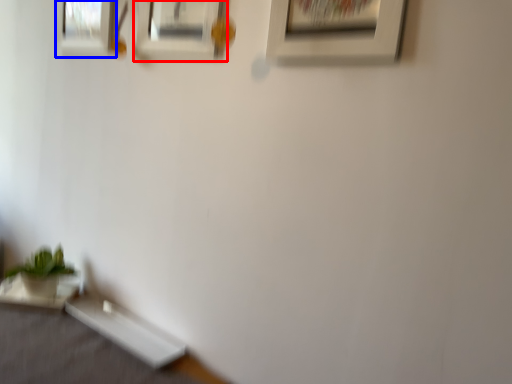
Question: Among these objects, which one is farthest to the camera, picture frame (highlighted by a red box) or picture frame (highlighted by a blue box)?

Choices:
 (A) picture frame
 (B) picture frame

Answer: (B)